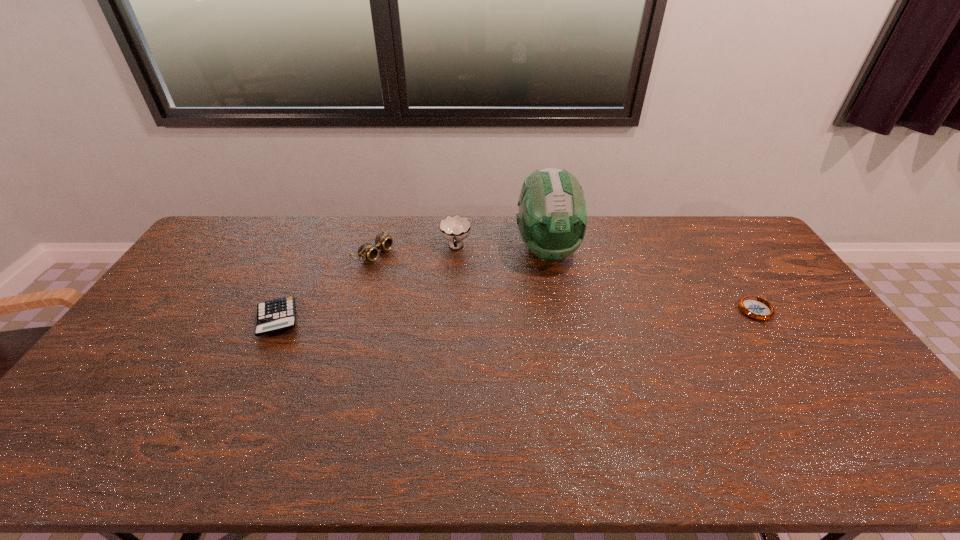
This screenshot has height=540, width=960. Find the location of `vacant space on the desktop that is between the fourth tallest object and the rightmost object and is positioned on the visor of the fourth object from left to right`. vacant space on the desktop that is between the fourth tallest object and the rightmost object and is positioned on the visor of the fourth object from left to right is located at coordinates (564, 315).

Locate an element on the screen. The height and width of the screenshot is (540, 960). free space on the desktop that is between the second shortest object and the shortest object and is positioned through the lenses of the goggles is located at coordinates (508, 316).

This screenshot has height=540, width=960. I want to click on free space on the desktop that is between the second shortest object and the rightmost object and is positioned on the side of the cup with the handle, so click(x=456, y=317).